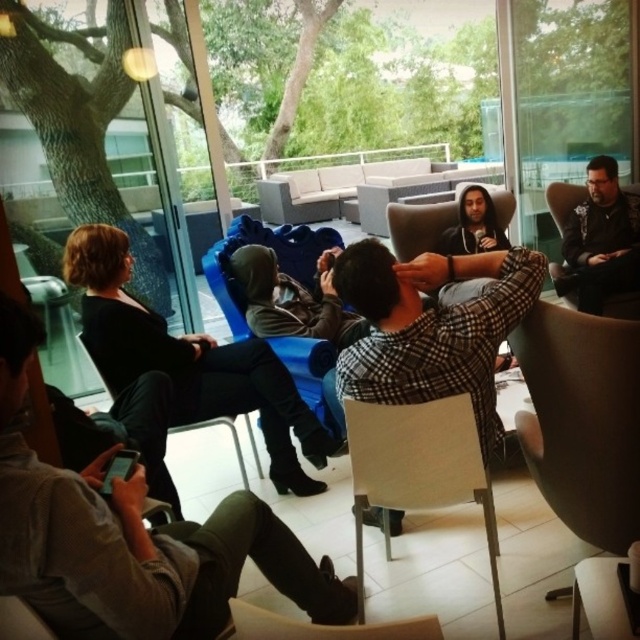
Looking at this image, you are a guest at this gathering and want to place your dark gray fabric jacket at center on the light beige fabric chair at center. Will the jacket fit on the chair without hanging off the sides?

The dark gray fabric jacket at center has a greater height compared to the light beige fabric chair at center. Since the jacket is taller than the chair, it might not fit properly and could hang off the sides.

You are organizing a coat rack for guests at the event. You have two jackets to hang up. The dark gray fabric jacket at center and the black fabric jacket at center. Which jacket should you choose to hang first if you want to place the narrower one on the left side of the rack?

The dark gray fabric jacket at center has a lesser width compared to the black fabric jacket at center, so you should hang the dark gray fabric jacket at center first on the left side of the rack.

You are standing in the living room and want to pick up the dark gray fabric jacket at center. Where exactly should you look to find it?

The dark gray fabric jacket at center is located at the coordinates point (131, 538).